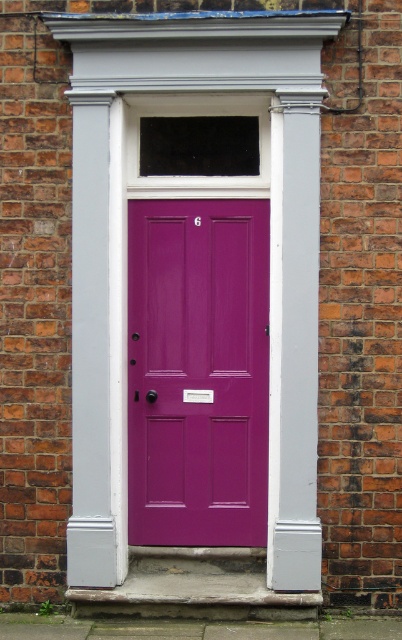
You are a delivery person trying to push a 1.2 meter wide cart through the glossy purple door at center. The matte gray column at center is in the way. Can you pass through the door with your cart?

The matte gray column at center might be wider than glossy purple door at center, so there is a risk that the column is wider than the door. If the column is wider, the space between the column and the door frame may be too narrow for the 1.2 meter wide cart to pass through safely. You should check the actual width before attempting to move the cart through.

You are standing in front of the purple door and need to determine the relative positions of two points marked on the door. Which point is closer to you, point (x=125, y=211) or point (x=178, y=352)?

Point (x=125, y=211) is closer to the camera than point (x=178, y=352).